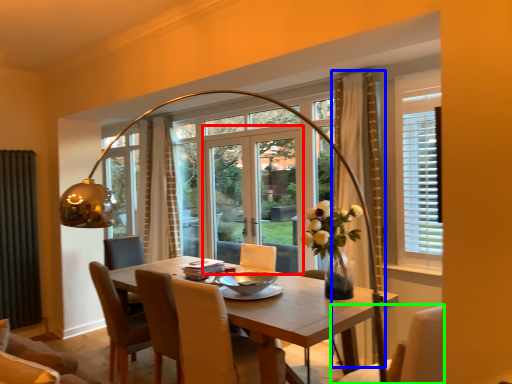
Question: Considering the real-world distances, which object is farthest from screen door (highlighted by a red box)? curtain (highlighted by a blue box) or chair (highlighted by a green box)?

Choices:
 (A) curtain
 (B) chair

Answer: (B)